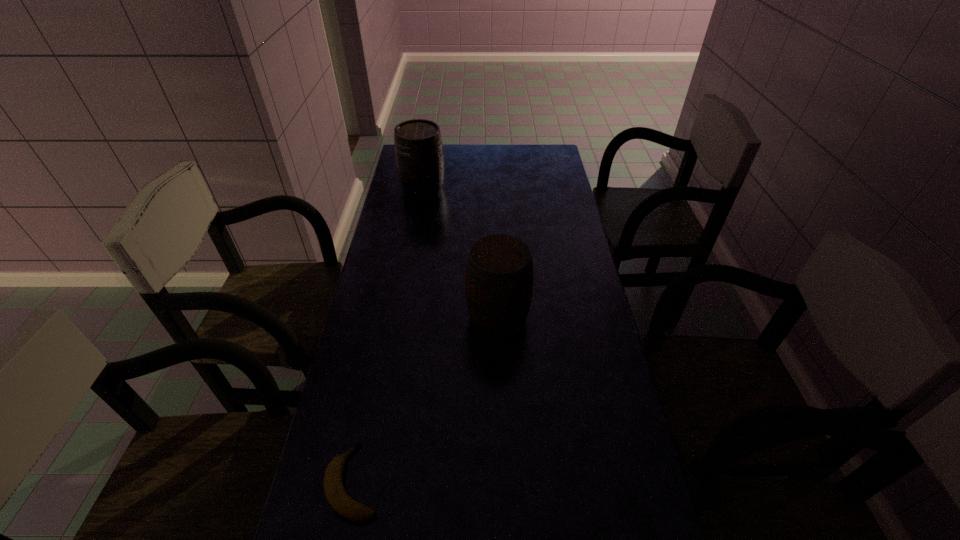
This screenshot has height=540, width=960. Identify the location of banana that is at the left edge. (336, 495).

Image resolution: width=960 pixels, height=540 pixels. What are the coordinates of `vacant space at the far edge of the desktop` in the screenshot? It's located at (483, 153).

This screenshot has width=960, height=540. In the image, there is a desktop. In order to click on vacant space at the left edge in this screenshot , I will do `click(356, 495)`.

The image size is (960, 540). In order to click on free space at the right edge in this screenshot , I will do `click(587, 488)`.

Where is `empty space that is in between the rightmost object and the farther cider`? empty space that is in between the rightmost object and the farther cider is located at coordinates (461, 253).

What are the coordinates of `free area in between the nearer cider and the banana` in the screenshot? It's located at (426, 399).

Find the location of a particular element. Image resolution: width=960 pixels, height=540 pixels. empty space between the rightmost object and the farthest object is located at coordinates (461, 253).

Where is `free area in between the second farthest object and the farther cider`? free area in between the second farthest object and the farther cider is located at coordinates (461, 253).

Where is `the closest object relative to the nearer cider`? the closest object relative to the nearer cider is located at coordinates (336, 495).

You are a GUI agent. You are given a task and a screenshot of the screen. Output one action in this format:
    pyautogui.click(x=<x>, y=<y>)
    Task: Click on the second closest object relative to the nearest object
    
    Given the screenshot: What is the action you would take?
    pyautogui.click(x=419, y=154)